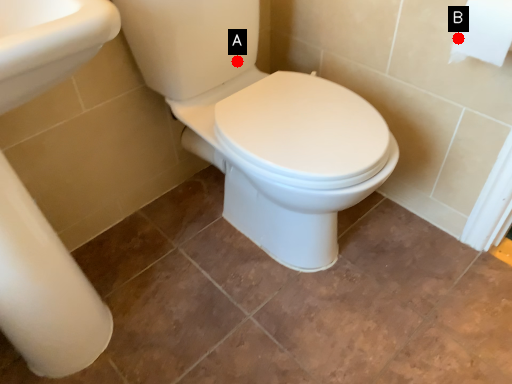
Question: Two points are circled on the image, labeled by A and B beside each circle. Which point appears farthest from the camera in this image?

Choices:
 (A) A is further
 (B) B is further

Answer: (A)